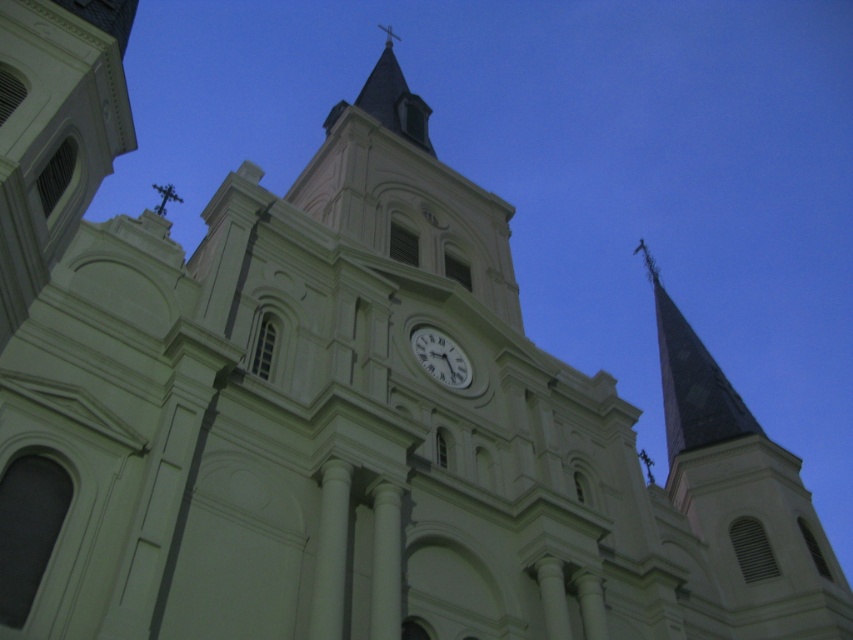
Which is more to the right, dark gray slate spire at upper right or white glossy clock at center?

Positioned to the right is dark gray slate spire at upper right.

Describe the element at coordinates (691, 381) in the screenshot. I see `dark gray slate spire at upper right` at that location.

Locate an element on the screen. dark gray slate spire at upper right is located at coordinates (691, 381).

From the picture: Is smooth gray steeple at right behind dark gray slate spire at upper right?

No, it is not.

Between smooth gray steeple at right and dark gray slate spire at upper right, which one has more height?

smooth gray steeple at right is taller.

Which is behind, point (680, 349) or point (666, 460)?

Positioned behind is point (666, 460).

The width and height of the screenshot is (853, 640). I want to click on smooth gray steeple at right, so click(x=741, y=493).

Can you confirm if smooth gray steeple at right is positioned above white glossy clock at center?

No, smooth gray steeple at right is not above white glossy clock at center.

From the picture: Is smooth gray steeple at right further to the viewer compared to white glossy clock at center?

No, smooth gray steeple at right is in front of white glossy clock at center.

Where is `smooth gray steeple at right`? The width and height of the screenshot is (853, 640). smooth gray steeple at right is located at coordinates (741, 493).